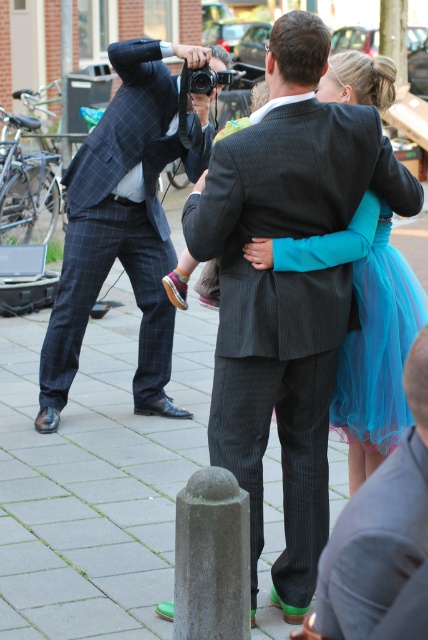
Question: Which point is farther to the camera?

Choices:
 (A) dark gray pinstripe suit at center
 (B) pinstriped wool suit at center
 (C) matte black camera at upper center

Answer: (C)

Question: Is pinstriped wool suit at center closer to camera compared to matte black camera at upper center?

Choices:
 (A) yes
 (B) no

Answer: (A)

Question: Is the position of dark gray pinstripe suit at center less distant than that of turquoise tulle dress at center?

Choices:
 (A) yes
 (B) no

Answer: (A)

Question: Is plaid wool suit at left smaller than turquoise tulle dress at center?

Choices:
 (A) no
 (B) yes

Answer: (A)

Question: Which of the following is the closest to the observer?

Choices:
 (A) (122, 122)
 (B) (389, 536)

Answer: (B)

Question: Which point is closer to the camera?

Choices:
 (A) (374, 573)
 (B) (365, 451)
 (C) (243, 240)

Answer: (A)